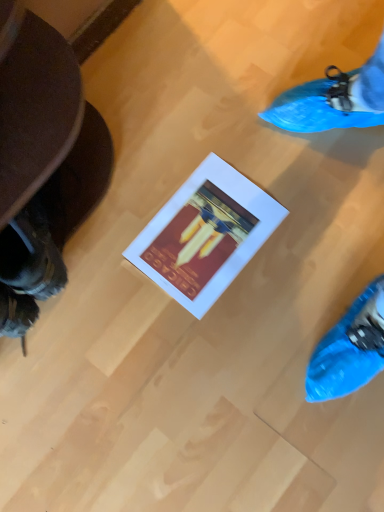
Where is `vacant space to the left of white matte picture frame at center`? vacant space to the left of white matte picture frame at center is located at coordinates (114, 264).